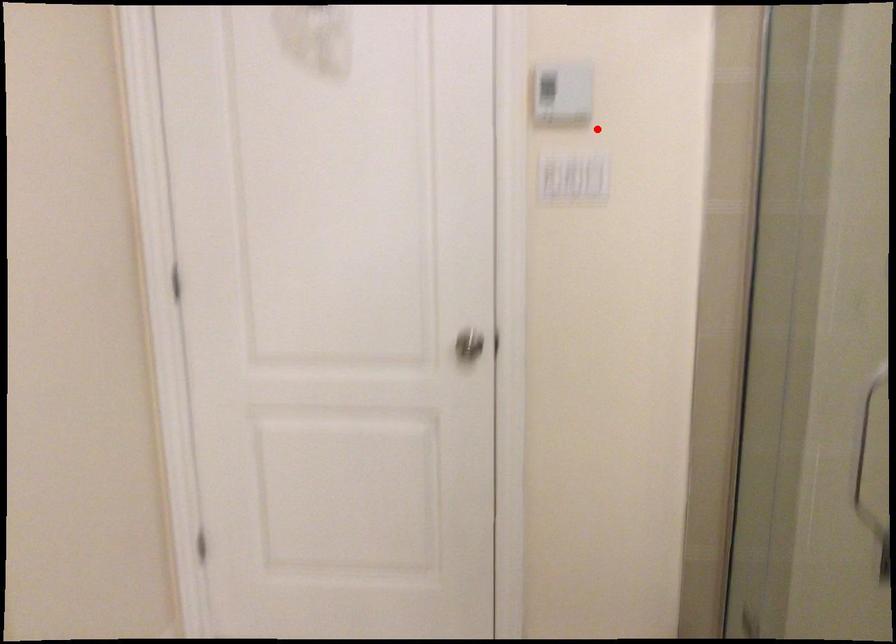
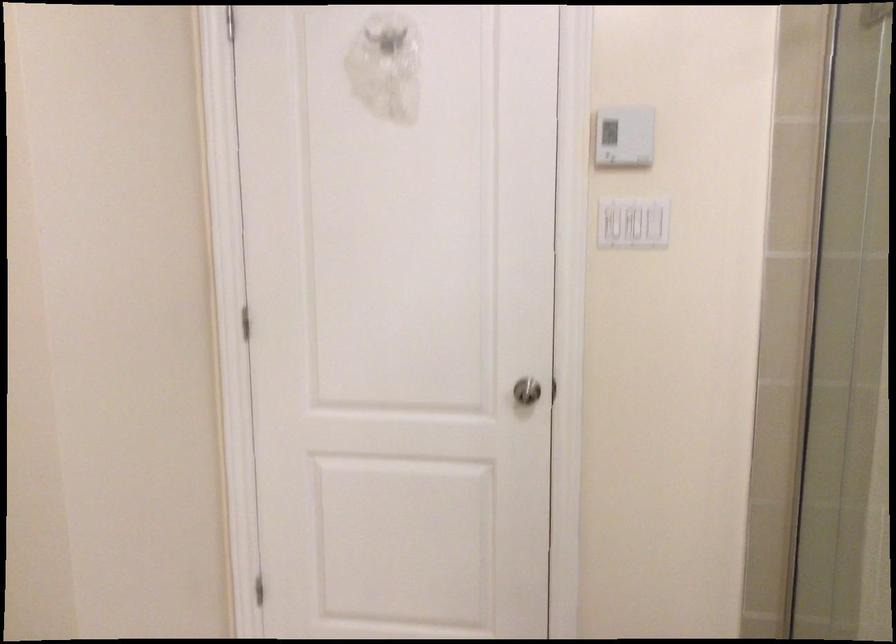
The point at the highlighted location is marked in the first image. Where is the corresponding point in the second image?

(655, 222)